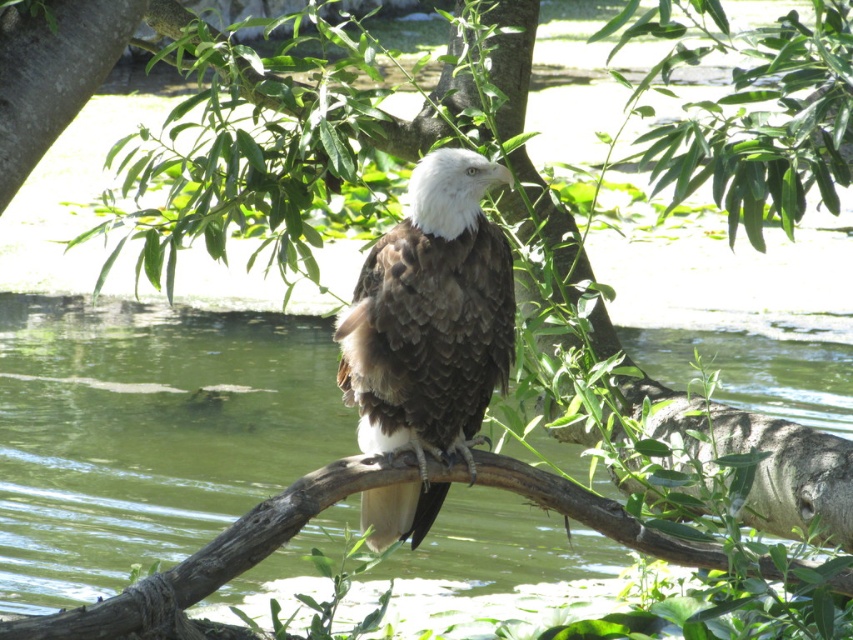
You are a wildlife photographer aiming to capture the brown feathered bald eagle at center and the brown rough tree branch at center in your shot. Which object is positioned to the left side of the other?

The brown feathered bald eagle at center is to the left of the brown rough tree branch at center.

You are a photographer aiming to capture the brown feathered bald eagle at center and the brown rough tree branch at center in a single shot. Which object will appear closer to the camera in the photo?

The brown feathered bald eagle at center will appear closer to the camera because it is positioned further to the viewer than the brown rough tree branch at center.